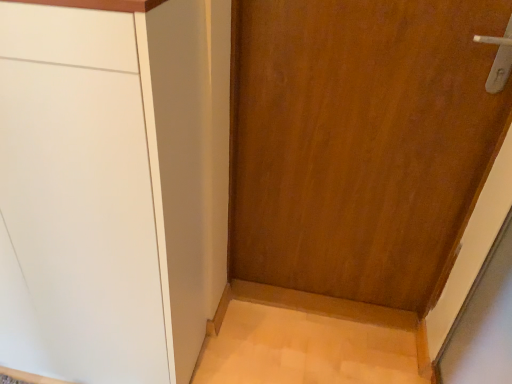
Question: Does point (398, 38) appear closer or farther from the camera than point (33, 110)?

Choices:
 (A) farther
 (B) closer

Answer: (A)

Question: Is wooden door at center wider or thinner than matte white cabinet at left?

Choices:
 (A) wide
 (B) thin

Answer: (B)

Question: Do you think wooden door at center is within matte white cabinet at left, or outside of it?

Choices:
 (A) outside
 (B) inside

Answer: (A)

Question: Would you say matte white cabinet at left is to the left or to the right of wooden door at center in the picture?

Choices:
 (A) left
 (B) right

Answer: (A)

Question: Is matte white cabinet at left inside or outside of wooden door at center?

Choices:
 (A) outside
 (B) inside

Answer: (A)

Question: Considering their positions, is matte white cabinet at left located in front of or behind wooden door at center?

Choices:
 (A) behind
 (B) front

Answer: (B)

Question: Is matte white cabinet at left taller or shorter than wooden door at center?

Choices:
 (A) tall
 (B) short

Answer: (A)